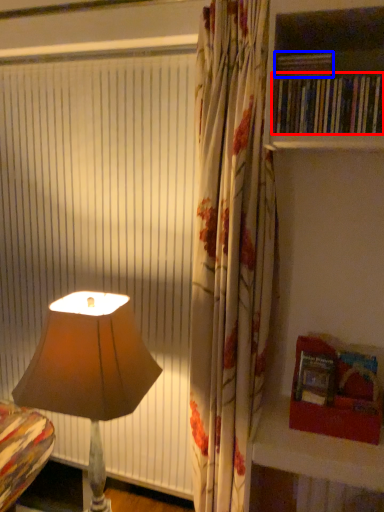
Question: Among these objects, which one is farthest to the camera, book (highlighted by a red box) or book (highlighted by a blue box)?

Choices:
 (A) book
 (B) book

Answer: (B)